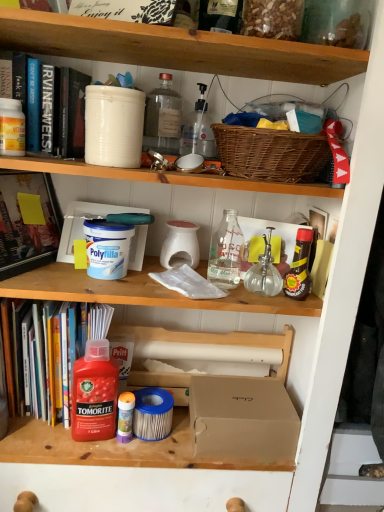
Identify the location of transparent glass bottle at center-right, the 6th bottle in the left-to-right sequence. The width and height of the screenshot is (384, 512). (264, 272).

Describe the element at coordinates (299, 267) in the screenshot. Image resolution: width=384 pixels, height=512 pixels. I see `shiny brown bottle at right, the 7th bottle in the left-to-right sequence` at that location.

The image size is (384, 512). What are the coordinates of `hardcover book at left, acting as the third book starting from the top` in the screenshot? It's located at (52, 354).

In the scene shown: Which object is closer to the camera taking this photo, clear glass bottle at center, the third bottle positioned from the right, or translucent plastic bottle at upper center, arranged as the 4th bottle when viewed from the right?

clear glass bottle at center, the third bottle positioned from the right, is closer to the camera.

From a real-world perspective, which object stands above the other?

translucent plastic bottle at upper center, arranged as the 4th bottle when viewed from the right, from a real-world perspective.

Is clear glass bottle at center, the fifth bottle when ordered from left to right, oriented towards translucent plastic bottle at upper center, the 4th bottle when ordered from left to right?

No, clear glass bottle at center, the fifth bottle when ordered from left to right, does not turn towards translucent plastic bottle at upper center, the 4th bottle when ordered from left to right.

Considering the positions of point (242, 237) and point (197, 105), is point (242, 237) closer or farther from the camera than point (197, 105)?

Point (242, 237) appears to be closer to the viewer than point (197, 105).

Is there a large distance between translucent plastic glue stick at lower center, the sixth bottle when ordered from right to left, and clear glass bottle at center, the fifth bottle when ordered from left to right?

translucent plastic glue stick at lower center, the sixth bottle when ordered from right to left, is near clear glass bottle at center, the fifth bottle when ordered from left to right, not far away.

Between translucent plastic glue stick at lower center, positioned as the second bottle in left-to-right order, and clear glass bottle at center, the fifth bottle when ordered from left to right, which one has smaller width?

translucent plastic glue stick at lower center, positioned as the second bottle in left-to-right order, is thinner.

Is translucent plastic glue stick at lower center, positioned as the second bottle in left-to-right order, smaller than clear glass bottle at center, the third bottle positioned from the right?

Indeed, translucent plastic glue stick at lower center, positioned as the second bottle in left-to-right order, has a smaller size compared to clear glass bottle at center, the third bottle positioned from the right.

Which point is more distant from viewer, (126, 432) or (242, 248)?

The point (242, 248) is farther from the camera.

Between hardcover book at left, acting as the third book starting from the top, and white matte bucket at upper center, placed as the second bucket when sorted from top to bottom, which one has less height?

With less height is white matte bucket at upper center, placed as the second bucket when sorted from top to bottom.

Is hardcover book at left, which ranks as the 1th book in bottom-to-top order, looking in the opposite direction of white matte bucket at upper center, arranged as the third bucket when viewed from the left?

hardcover book at left, which ranks as the 1th book in bottom-to-top order, is not turned away from white matte bucket at upper center, arranged as the third bucket when viewed from the left.

From the image's perspective, is hardcover book at left, which ranks as the 1th book in bottom-to-top order, over white matte bucket at upper center, which is counted as the 2th bucket, starting from the bottom?

Incorrect, from the image's perspective, hardcover book at left, which ranks as the 1th book in bottom-to-top order, is lower than white matte bucket at upper center, which is counted as the 2th bucket, starting from the bottom.

Is hardcover book at left, acting as the third book starting from the top, far from white matte bucket at upper center, which appears as the 1th bucket when viewed from the right?

No.

Could you tell me if transparent glass bottle at center-right, the 2th bottle in the right-to-left sequence, is turned towards translucent plastic glue stick at lower center, positioned as the second bottle in left-to-right order?

No, transparent glass bottle at center-right, the 2th bottle in the right-to-left sequence, is not facing towards translucent plastic glue stick at lower center, positioned as the second bottle in left-to-right order.

Based on the photo, is translucent plastic glue stick at lower center, the sixth bottle when ordered from right to left, a part of transparent glass bottle at center-right, the 2th bottle in the right-to-left sequence?

No, transparent glass bottle at center-right, the 2th bottle in the right-to-left sequence, does not contain translucent plastic glue stick at lower center, the sixth bottle when ordered from right to left.

Can you confirm if transparent glass bottle at center-right, the 6th bottle in the left-to-right sequence, is wider than translucent plastic glue stick at lower center, the sixth bottle when ordered from right to left?

Yes.

Can you tell me how much transparent glass bottle at center-right, the 6th bottle in the left-to-right sequence, and translucent plastic glue stick at lower center, the sixth bottle when ordered from right to left, differ in facing direction?

They differ by 29.3 degrees in their facing directions.

Looking at their sizes, would you say white matte polyfilla at center, the 2th bucket from the left, is wider or thinner than clear glass bottle at center, the fifth bottle when ordered from left to right?

In the image, white matte polyfilla at center, the 2th bucket from the left, appears to be more narrow than clear glass bottle at center, the fifth bottle when ordered from left to right.

Looking at the image, does white matte polyfilla at center, which appears as the third bucket when viewed from the top, seem bigger or smaller compared to clear glass bottle at center, the third bottle positioned from the right?

white matte polyfilla at center, which appears as the third bucket when viewed from the top, is bigger than clear glass bottle at center, the third bottle positioned from the right.

In the image, is white matte polyfilla at center, which appears as the third bucket when viewed from the top, on the left side or the right side of clear glass bottle at center, the fifth bottle when ordered from left to right?

white matte polyfilla at center, which appears as the third bucket when viewed from the top, is positioned on clear glass bottle at center, the fifth bottle when ordered from left to right,'s left side.

Find the location of a particular element. The width and height of the screenshot is (384, 512). the 1st bottle directly beneath the white matte polyfilla at center, the 2th bucket from the left (from a real-world perspective) is located at coordinates (226, 252).

Between point (193, 117) and point (275, 149), which one is positioned behind?

The point (193, 117) is farther from the camera.

Find the location of a particular element. The height and width of the screenshot is (512, 384). picnic basket lying on the right of translucent plastic bottle at upper center, arranged as the 4th bottle when viewed from the right is located at coordinates (271, 154).

Considering the sizes of objects translucent plastic bottle at upper center, arranged as the 4th bottle when viewed from the right, and woven brown picnic basket at upper right in the image provided, who is taller, translucent plastic bottle at upper center, arranged as the 4th bottle when viewed from the right, or woven brown picnic basket at upper right?

Standing taller between the two is translucent plastic bottle at upper center, arranged as the 4th bottle when viewed from the right.

From the picture: Is translucent plastic bottle at upper center, arranged as the 4th bottle when viewed from the right, bigger than woven brown picnic basket at upper right?

No, translucent plastic bottle at upper center, arranged as the 4th bottle when viewed from the right, is not bigger than woven brown picnic basket at upper right.

From the image's perspective, is white matte polyfilla container at center-left, positioned as the first box in left-to-right order, positioned above or below woven brown picnic basket at upper right?

white matte polyfilla container at center-left, positioned as the first box in left-to-right order, is situated lower than woven brown picnic basket at upper right in the image.

From a real-world perspective, is white matte polyfilla container at center-left, positioned as the 2th box in bottom-to-top order, on woven brown picnic basket at upper right?

No, from a real-world perspective, white matte polyfilla container at center-left, positioned as the 2th box in bottom-to-top order, is not above woven brown picnic basket at upper right.

Are white matte polyfilla container at center-left, positioned as the 2th box in bottom-to-top order, and woven brown picnic basket at upper right far apart?

No, white matte polyfilla container at center-left, positioned as the 2th box in bottom-to-top order, is not far away from woven brown picnic basket at upper right.

Considering the relative sizes of white matte polyfilla container at center-left, arranged as the 1th box when viewed from the top, and woven brown picnic basket at upper right in the image provided, is white matte polyfilla container at center-left, arranged as the 1th box when viewed from the top, shorter than woven brown picnic basket at upper right?

No.

Find the location of a particular element. This screenshot has height=512, width=384. the 1st bottle counting from the right side of the translucent plastic bottle at upper center, arranged as the 4th bottle when viewed from the right is located at coordinates (226, 252).

From a real-world perspective, which bottle is the 2nd one above the translucent plastic glue stick at lower center, positioned as the second bottle in left-to-right order? Please provide its 2D coordinates.

[(226, 252)]

Consider the image. When comparing their distances from hardcover book at left, placed as the second book when sorted from top to bottom, does hardcover book at upper left, which is the third book from bottom to top, or white matte bucket at upper left, which is counted as the first bucket, starting from the top, seem closer?

hardcover book at upper left, which is the third book from bottom to top, is positioned closer to the anchor hardcover book at left, placed as the second book when sorted from top to bottom.

Which object lies nearer to the anchor point shiny brown bottle at right, the 7th bottle in the left-to-right sequence, red glossy tomorite bottle at lower left, the first bottle when ordered from left to right, or hardcover book at left, the 2th book positioned from the bottom?

red glossy tomorite bottle at lower left, the first bottle when ordered from left to right, is closer to shiny brown bottle at right, the 7th bottle in the left-to-right sequence.

Based on their spatial positions, is transparent glass bottle at center-right, the 2th bottle in the right-to-left sequence, or clear glass bottle at center, the fifth bottle when ordered from left to right, further from transparent glass bottle at upper center, the third bottle when ordered from left to right?

transparent glass bottle at center-right, the 2th bottle in the right-to-left sequence, is further to transparent glass bottle at upper center, the third bottle when ordered from left to right.

Consider the image. Looking at the image, which one is located closer to red glossy tomorite bottle at lower left, marked as the 7th bottle in a right-to-left arrangement, hardcover book at upper left, the 1th book in the top-to-bottom sequence, or hardcover book at left, placed as the second book when sorted from top to bottom?

Among the two, hardcover book at left, placed as the second book when sorted from top to bottom, is located nearer to red glossy tomorite bottle at lower left, marked as the 7th bottle in a right-to-left arrangement.

When comparing their distances from translucent plastic bottle at upper center, arranged as the 4th bottle when viewed from the right, does clear glass bottle at center, the third bottle positioned from the right, or hardcover book at left, placed as the second book when sorted from top to bottom, seem further?

hardcover book at left, placed as the second book when sorted from top to bottom.

Which object lies further to the anchor point transparent glass bottle at upper center, the third bottle when ordered from left to right, brown cardboard box at center, which is the 1th box from bottom to top, or translucent plastic bottle at upper center, the 4th bottle when ordered from left to right?

brown cardboard box at center, which is the 1th box from bottom to top, is positioned further to the anchor transparent glass bottle at upper center, the third bottle when ordered from left to right.

From the image, which object appears to be nearer to clear glass bottle at center, the fifth bottle when ordered from left to right, white matte bucket at upper center, which appears as the 1th bucket when viewed from the right, or hardcover book at left, placed as the second book when sorted from top to bottom?

The object closer to clear glass bottle at center, the fifth bottle when ordered from left to right, is white matte bucket at upper center, which appears as the 1th bucket when viewed from the right.

Based on their spatial positions, is clear glass bottle at center, the third bottle positioned from the right, or translucent plastic glue stick at lower center, the sixth bottle when ordered from right to left, closer to shiny brown bottle at right, the 7th bottle in the left-to-right sequence?

Among the two, clear glass bottle at center, the third bottle positioned from the right, is located nearer to shiny brown bottle at right, the 7th bottle in the left-to-right sequence.

Image resolution: width=384 pixels, height=512 pixels. Identify the location of book between transparent glass bottle at upper center, the third bottle when ordered from left to right, and hardcover book at left, acting as the third book starting from the top, in the up-down direction. (27, 222).

At what (x,y) coordinates should I click in order to perform the action: click on box situated between hardcover book at upper left, which is the third book from bottom to top, and clear glass bottle at center, the third bottle positioned from the right, from left to right. Please return your answer as a coordinate pair (x, y). The image size is (384, 512). Looking at the image, I should click on (82, 223).

Image resolution: width=384 pixels, height=512 pixels. In order to click on box between hardcover book at left, the 2th book positioned from the bottom, and white matte bucket at upper center, placed as the second bucket when sorted from top to bottom, in the horizontal direction in this screenshot , I will do `click(82, 223)`.

The width and height of the screenshot is (384, 512). I want to click on book between white matte bucket at upper left, which is the first bucket in left-to-right order, and white matte polyfilla at center, which appears as the third bucket when viewed from the top, in the vertical direction, so click(x=27, y=222).